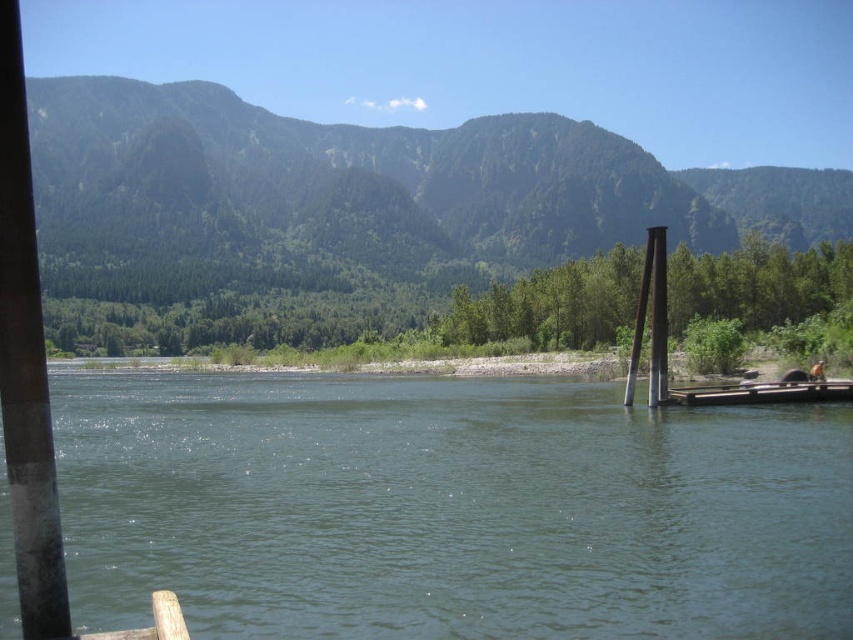
You are standing on the brown wooden dock at right and want to reach the smooth gray pole at left. Which direction should you walk to get there?

You should walk to the left from the brown wooden dock at right to reach the smooth gray pole at left since it is positioned to the left of the dock.